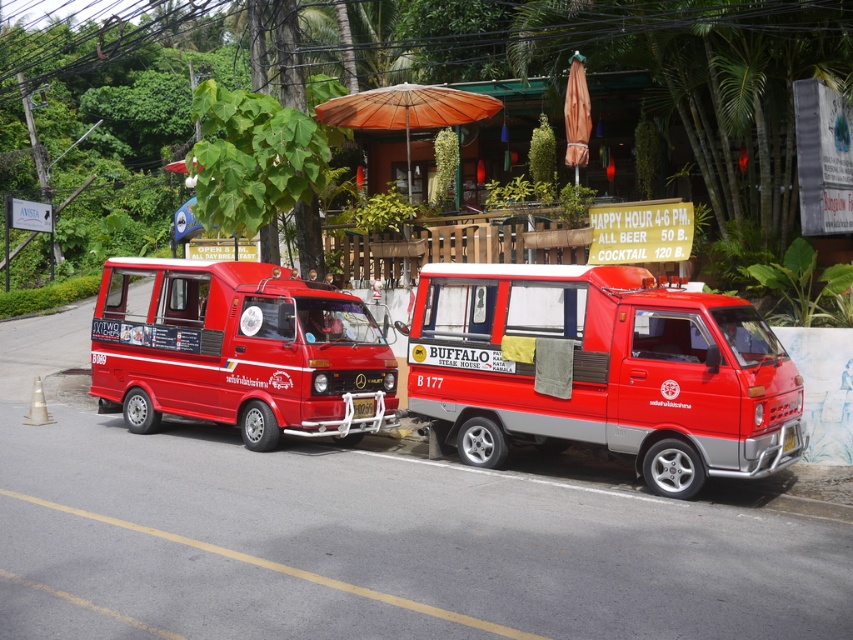
Question: Is shiny red van at center smaller than orange fabric umbrella at upper center?

Choices:
 (A) yes
 (B) no

Answer: (B)

Question: Which point appears closest to the camera in this image?

Choices:
 (A) 361,122
 (B) 366,410
 (C) 196,403
 (D) 582,97

Answer: (B)

Question: Which point is closer to the camera taking this photo?

Choices:
 (A) (427, 352)
 (B) (280, 340)

Answer: (A)

Question: Which of the following is the closest to the observer?

Choices:
 (A) matte red van at left
 (B) orange fabric umbrella at upper center

Answer: (A)

Question: Can you confirm if shiny red van at center is bigger than orange fabric umbrella at upper center?

Choices:
 (A) yes
 (B) no

Answer: (A)

Question: In this image, where is orange woven umbrella at center located relative to orange fabric umbrella at upper center?

Choices:
 (A) left
 (B) right

Answer: (A)